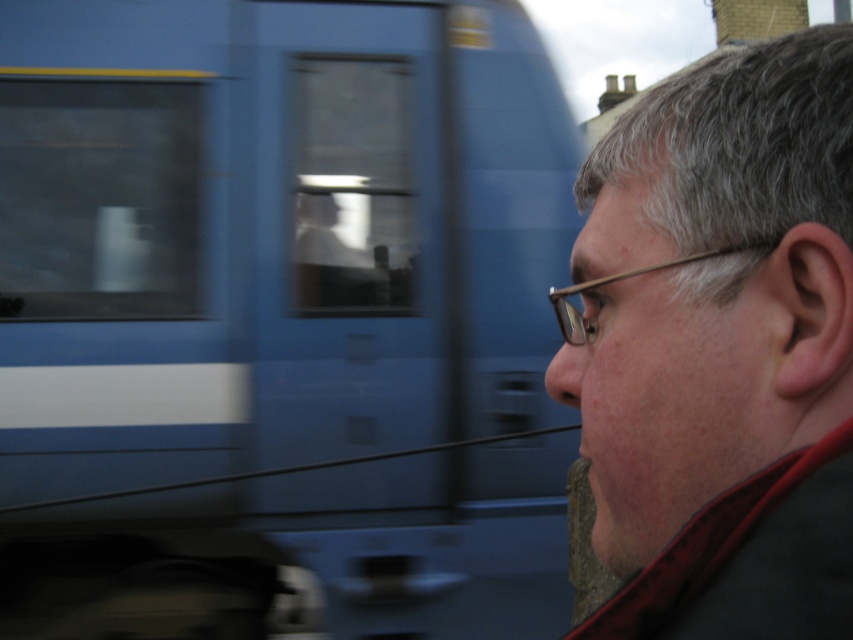
Question: Is blue glossy train at upper left positioned in front of matte black jacket at right?

Choices:
 (A) no
 (B) yes

Answer: (A)

Question: Which is farther from the blue glossy train at upper left?

Choices:
 (A) gold metallic glasses at right
 (B) matte black jacket at right

Answer: (B)

Question: Among these objects, which one is nearest to the camera?

Choices:
 (A) gold metallic glasses at right
 (B) blue glossy train at upper left
 (C) matte black jacket at right

Answer: (C)

Question: Can you confirm if blue glossy train at upper left is smaller than matte black jacket at right?

Choices:
 (A) yes
 (B) no

Answer: (B)

Question: Estimate the real-world distances between objects in this image. Which object is farther from the gold metallic glasses at right?

Choices:
 (A) matte black jacket at right
 (B) blue glossy train at upper left

Answer: (B)

Question: Can you confirm if blue glossy train at upper left is thinner than matte black jacket at right?

Choices:
 (A) yes
 (B) no

Answer: (B)